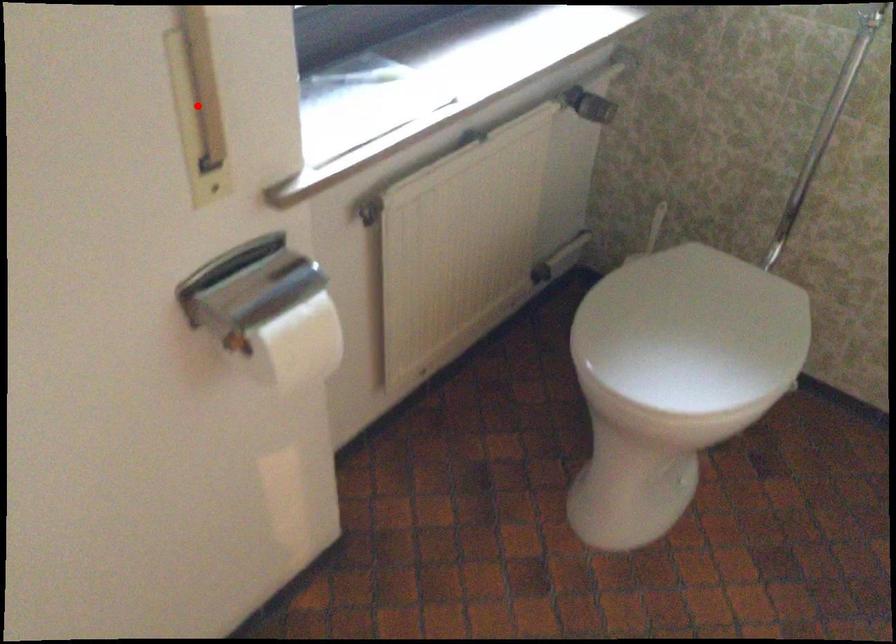
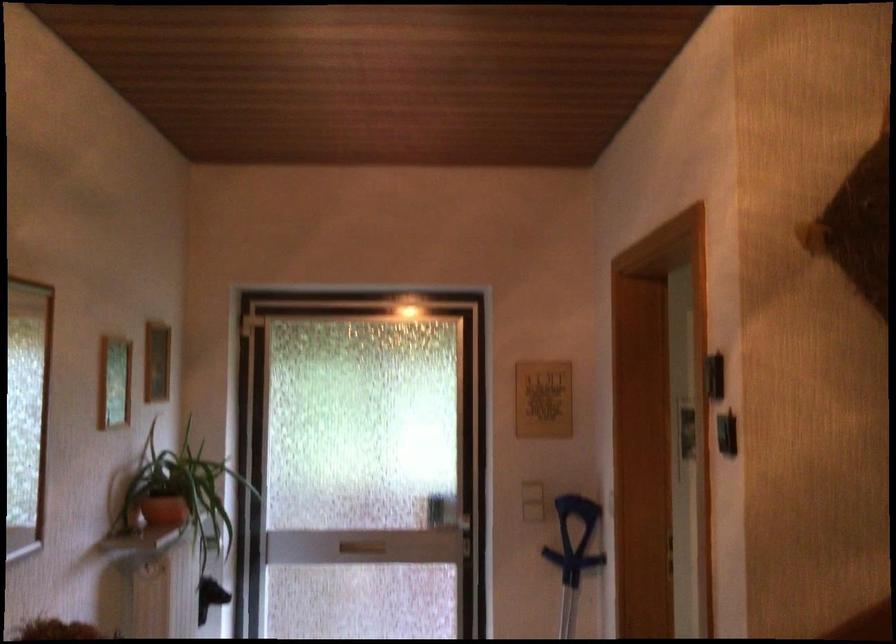
Question: I am providing you with two images of the same scene from different viewpoints. A red point is marked on the first image. Is the red point's position out of view in image 2?

Choices:
 (A) Yes
 (B) No

Answer: (A)